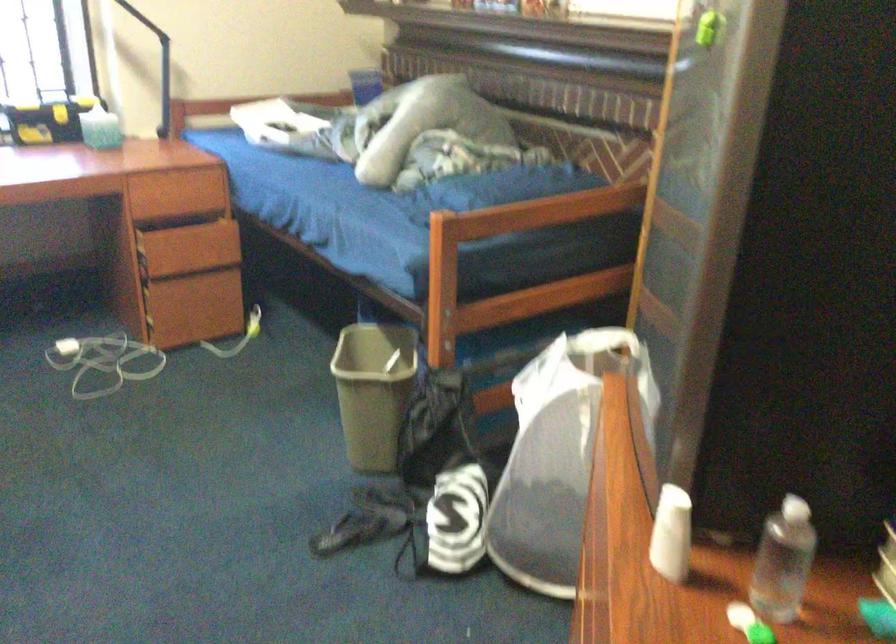
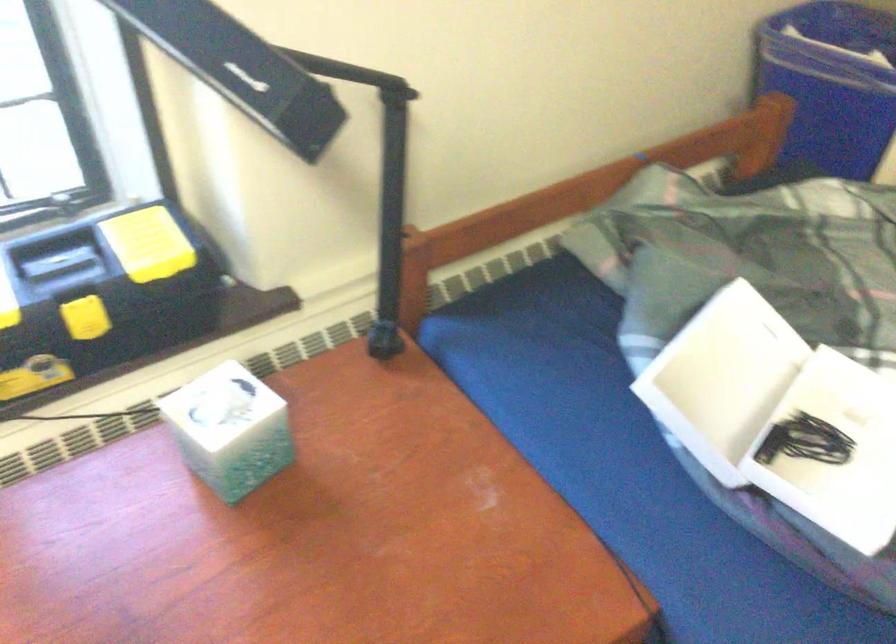
Question: I am providing you with two images of the same scene from different viewpoints. Which of the following objects are not visible in image2?

Choices:
 (A) yellow toolbox latch
 (B) black lamp head
 (C) square tissue box
 (D) none of these

Answer: (D)